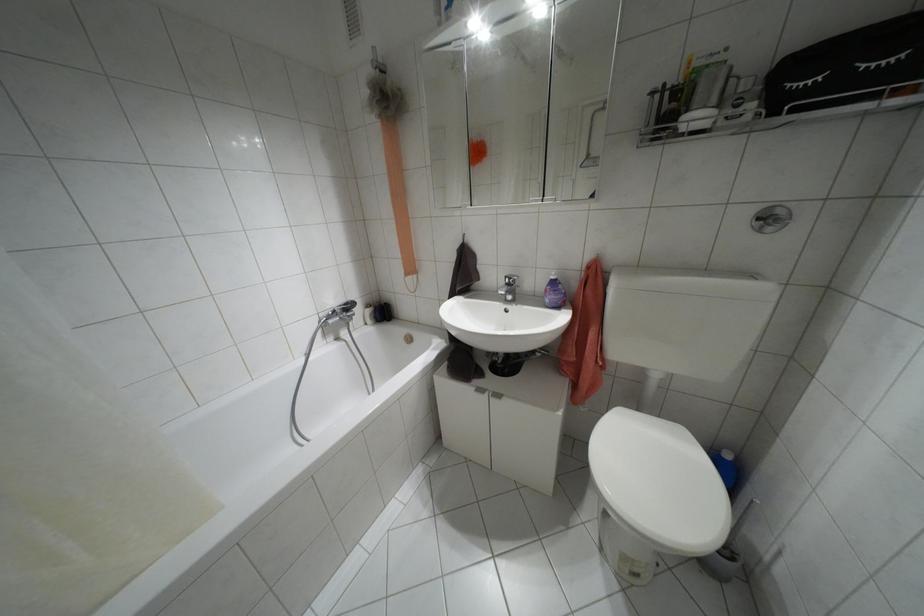
The width and height of the screenshot is (924, 616). I want to click on toilet brush handle, so click(x=743, y=517).